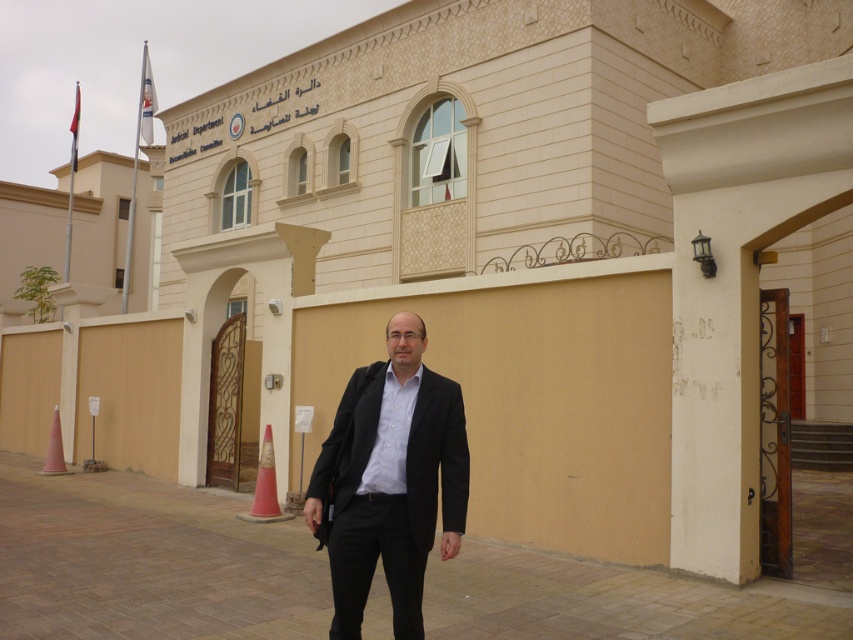
You are a delivery person who needs to park your vehicle near the beige building with the arched windows. There are two orange plastic cones on the ground. The orange plastic cone at lower center and the orange plastic cone at lower left. Which cone marks the larger parking spot?

The orange plastic cone at lower center marks the larger parking spot because it has a larger size compared to the orange plastic cone at lower left.

You are a photographer trying to capture a photo of the entrance of the beige building with the black matte suit at center and the orange plastic cone at lower left in the frame. Which object should be placed closer to the camera to ensure both are fully visible in the photo?

The black matte suit at center is taller than the orange plastic cone at lower left. To ensure both are fully visible in the photo, the taller object, the black matte suit at center, should be placed closer to the camera. This way, the height difference is minimized, allowing both objects to fit within the frame without one being cut off.